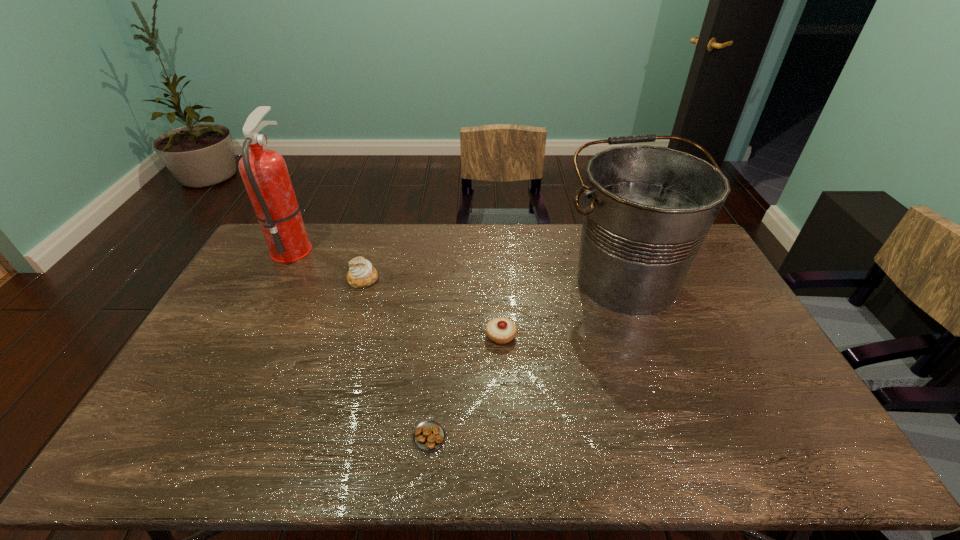
The width and height of the screenshot is (960, 540). I want to click on free space located 0.350m on the left of the leftmost pastry, so click(247, 279).

Image resolution: width=960 pixels, height=540 pixels. In order to click on free spot located on the right of the second nearest pastry in this screenshot , I will do `click(588, 335)`.

The height and width of the screenshot is (540, 960). Identify the location of vacant area situated on the left of the shortest pastry. (376, 436).

Identify the location of fire extinguisher present at the far edge. (264, 172).

This screenshot has width=960, height=540. Identify the location of bucket present at the far edge. (647, 210).

Image resolution: width=960 pixels, height=540 pixels. I want to click on object that is at the near edge, so click(x=429, y=435).

At what (x,y) coordinates should I click in order to perform the action: click on object present at the left edge. Please return your answer as a coordinate pair (x, y). Looking at the image, I should click on (264, 172).

The image size is (960, 540). Identify the location of object that is at the right edge. (647, 210).

I want to click on object at the far left corner, so click(x=264, y=172).

Where is `object that is at the far right corner`? This screenshot has height=540, width=960. object that is at the far right corner is located at coordinates (647, 210).